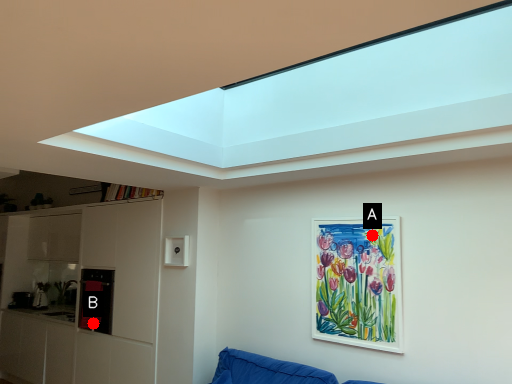
Question: Two points are circled on the image, labeled by A and B beside each circle. Which point is closer to the camera?

Choices:
 (A) A is closer
 (B) B is closer

Answer: (A)